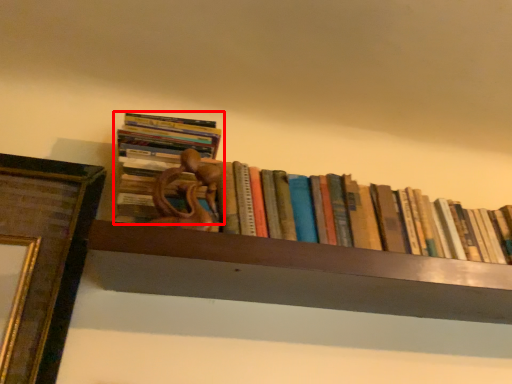
Question: Considering the relative positions of book (annotated by the red box) and book in the image provided, where is book (annotated by the red box) located with respect to the staircase?

Choices:
 (A) right
 (B) left

Answer: (B)